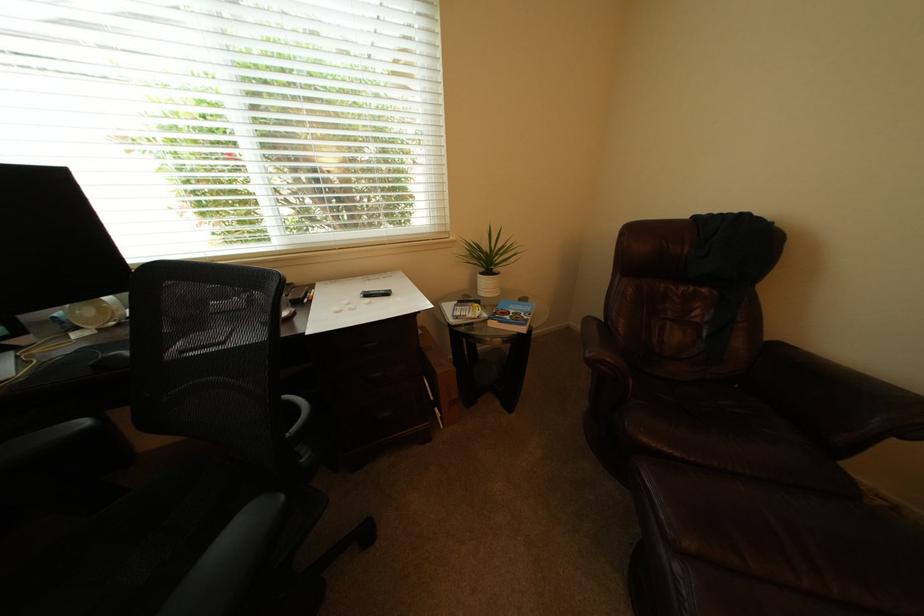
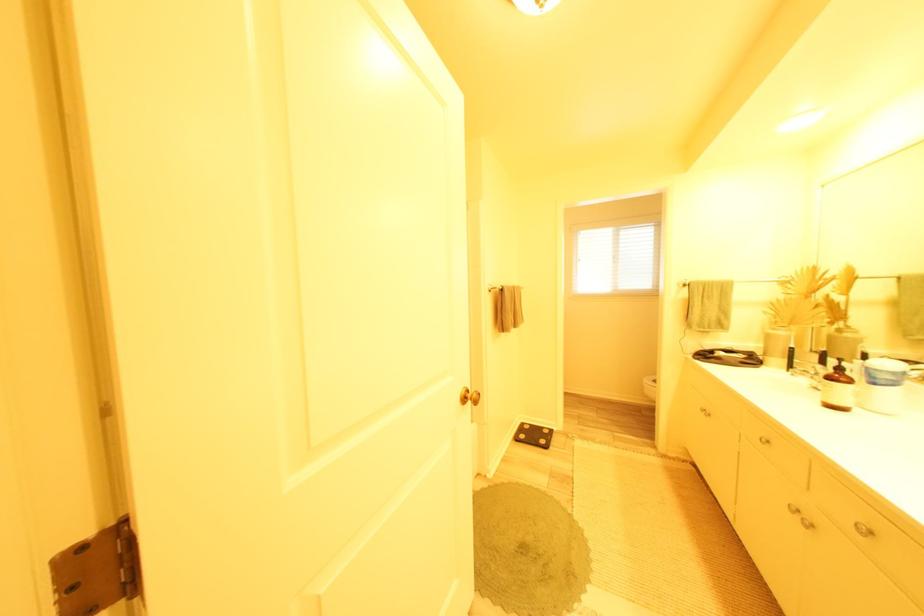
Question: I am providing you with two images of the same scene from different viewpoints. Which of the following objects are not visible in image2?

Choices:
 (A) cabinet knob
 (B) white round object
 (C) black bicycle seat
 (D) faucet handle

Answer: (B)